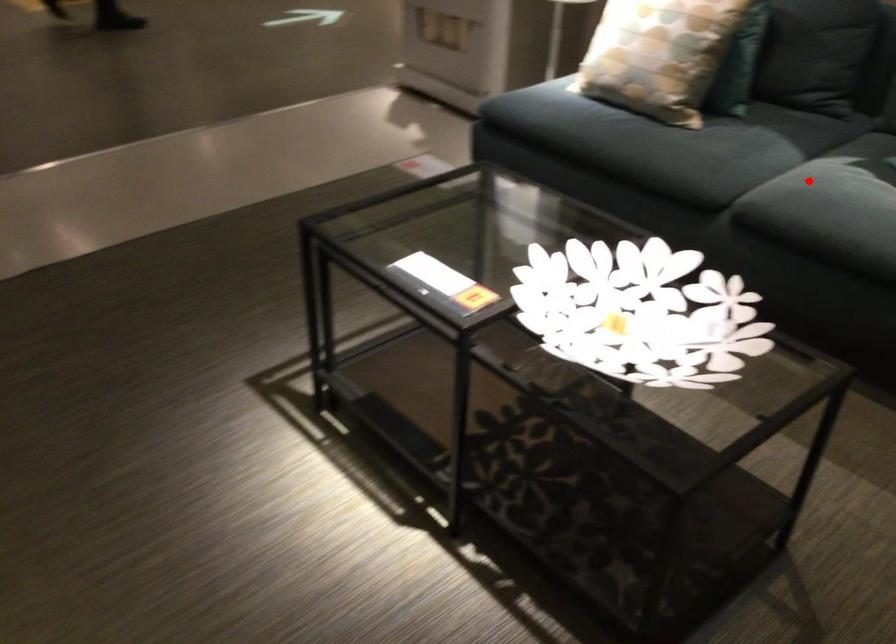
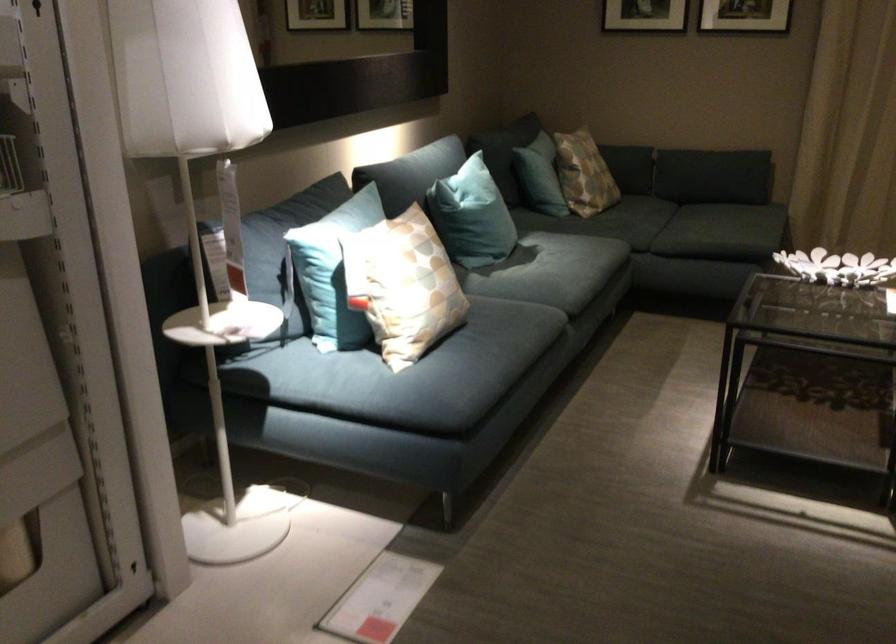
Locate, in the second image, the point that corresponds to the highlighted location in the first image.

(552, 275)